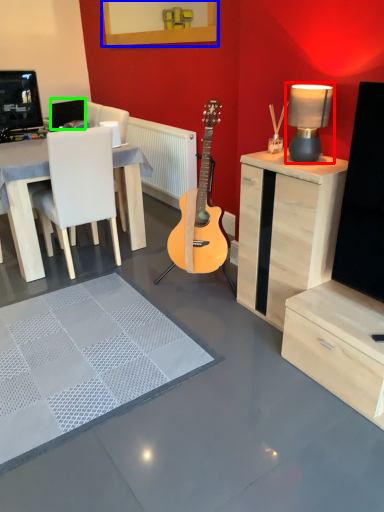
Question: Which object is positioned closest to table lamp (highlighted by a red box)? Select from picture frame (highlighted by a blue box) and speaker (highlighted by a green box).

Choices:
 (A) picture frame
 (B) speaker

Answer: (A)